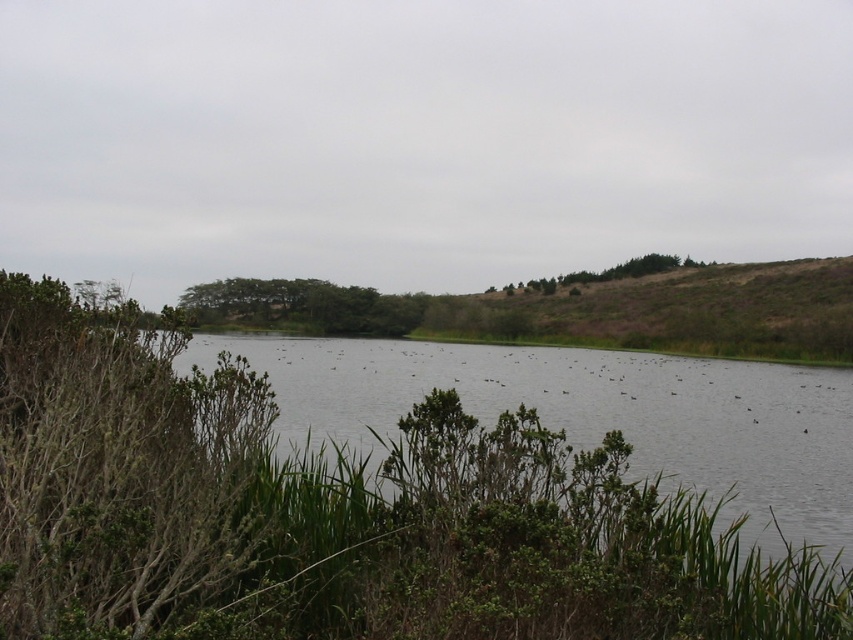
You are standing at the edge of the lake and want to take a photo of the clear water at center and the green leafy tree at upper center. Which object is positioned to the left of the other?

The clear water at center is to the left of the green leafy tree at upper center.

You are standing at the edge of the lake and want to locate two specific points in the scene. The first point is at coordinates point (822, 410) and the second is at point (323, 326). Which of these two points is nearer to your current position?

Point (822, 410) is closer to the camera than point (323, 326), so the first point is nearer to your current position.